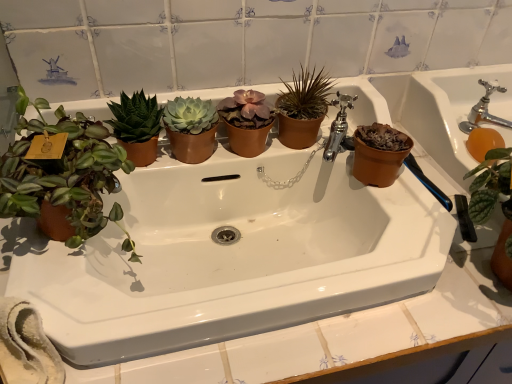
Where is `vacant area that is in front of brown terracotta pot at right`? This screenshot has width=512, height=384. vacant area that is in front of brown terracotta pot at right is located at coordinates (428, 283).